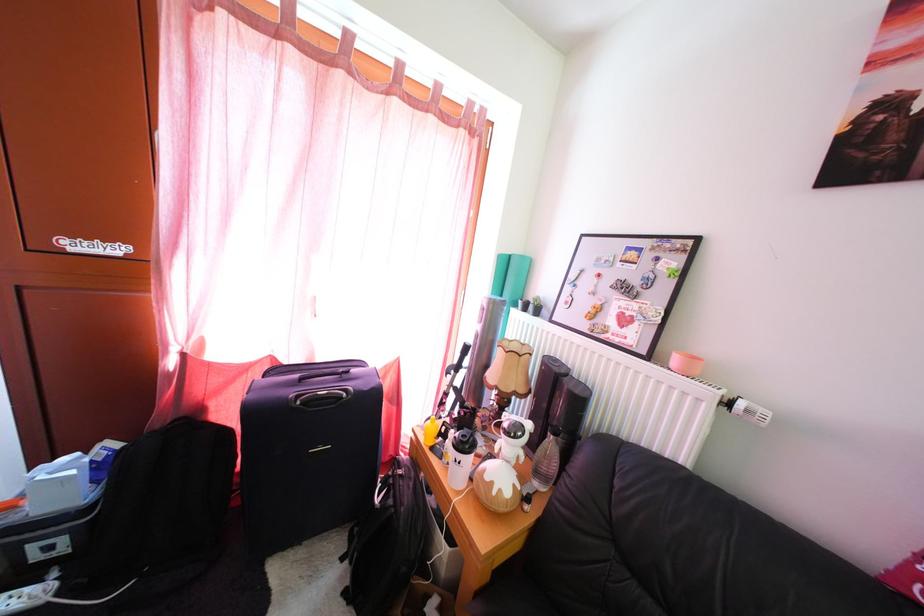
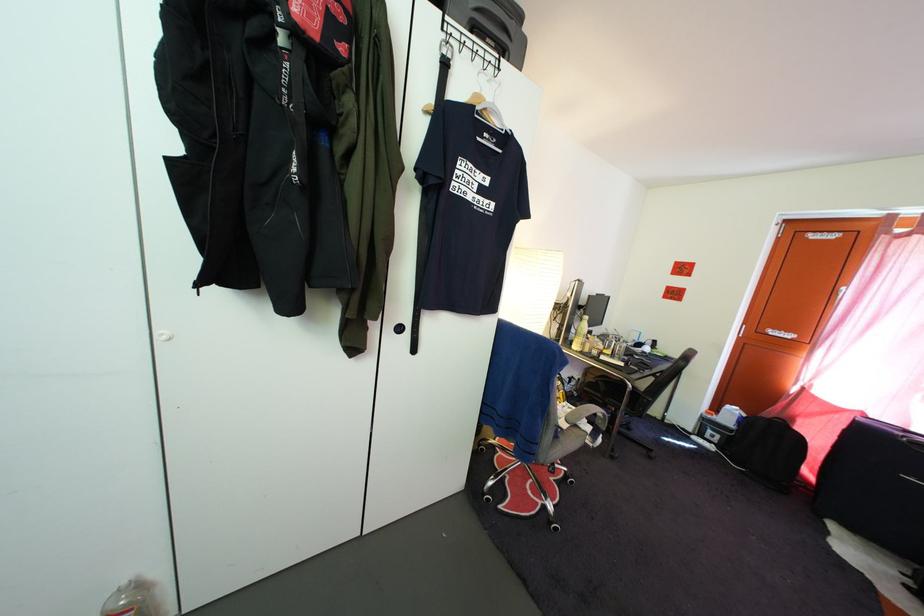
Where in the second image is the point corresponding to point (58, 557) from the first image?

(721, 445)